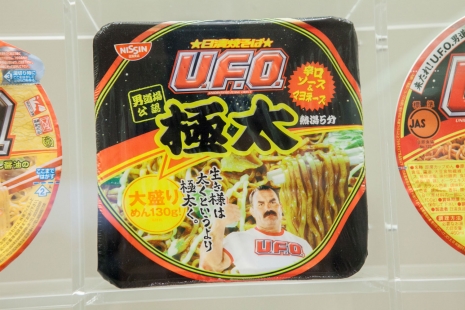
I want to click on tan tile, so click(x=265, y=295).